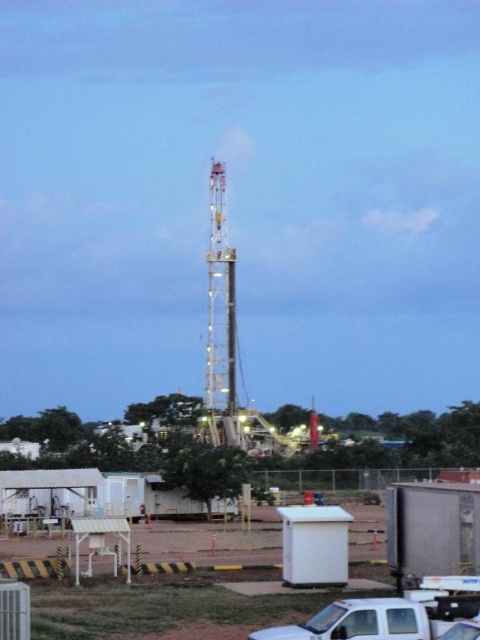
In the scene shown: You are a delivery driver who needs to park your truck in the industrial area shown in the image. You see a white plastic container at lower center and a white matte truck at lower center. Which object takes up more space in the parking area?

The white plastic container at lower center takes up more space in the parking area because it has a larger size compared to the white matte truck at lower center.

You are standing at the camera position observing the industrial site with the drilling rig at center. There is a point marked at coordinates point (398, 512). Can you reach this point within 1 minute if you walk at 1.5 meters per second?

The point (398, 512) is 48.19 meters away from camera. Walking at 1.5 meters per second would take 32.13 seconds, so yes, you can reach it within 1 minute.